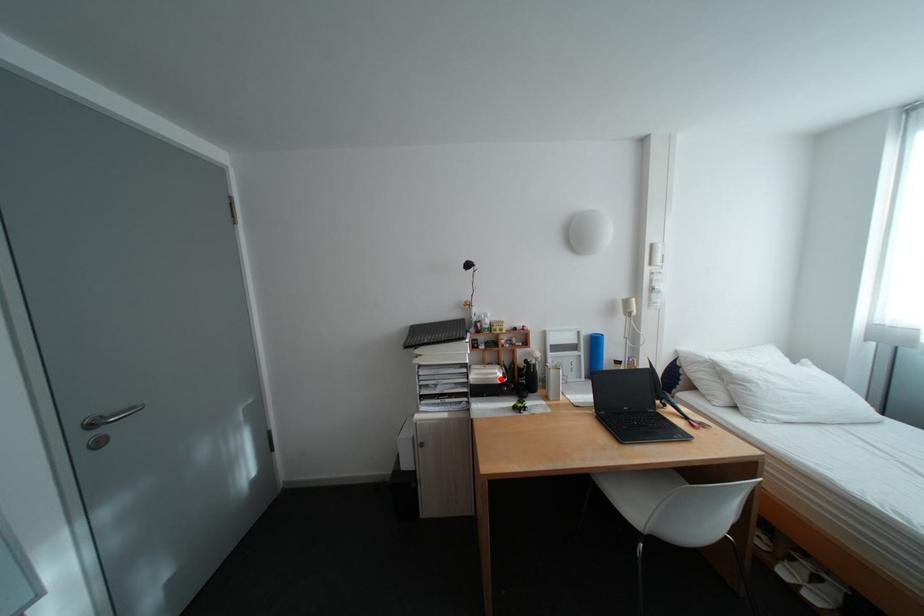
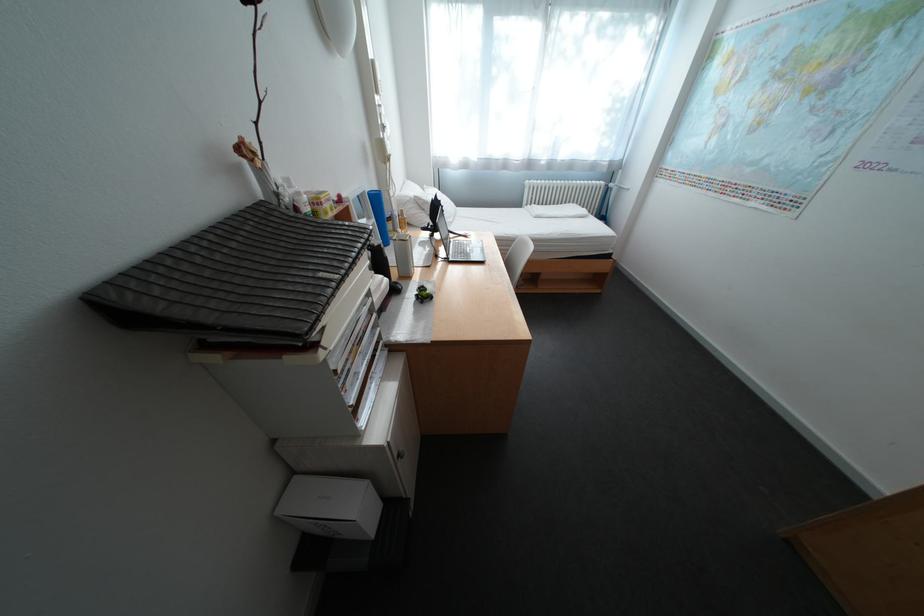
The point at the highlighted location is marked in the first image. Where is the corresponding point in the second image?

(395, 292)